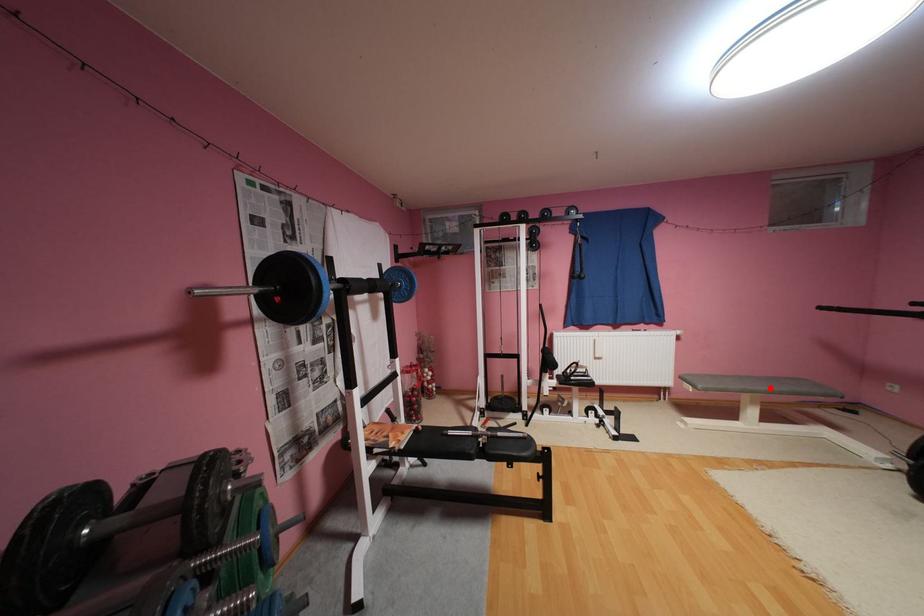
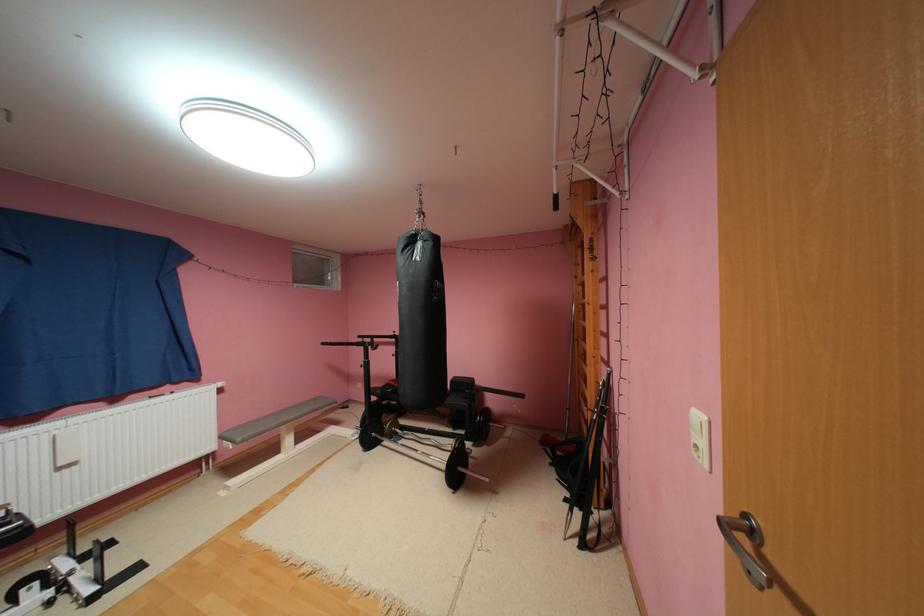
The point at the highlighted location is marked in the first image. Where is the corresponding point in the second image?

(300, 416)